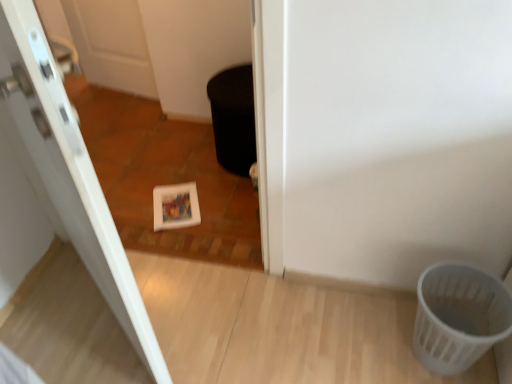
Locate an element on the screen. The width and height of the screenshot is (512, 384). vacant region above black matte potty at center (from a real-world perspective) is located at coordinates (229, 87).